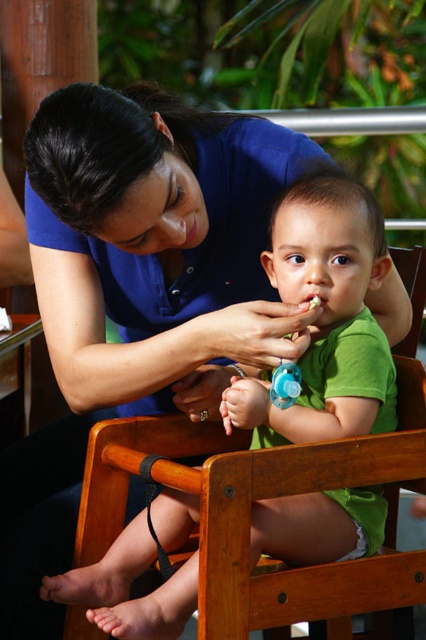
You are a parent trying to locate your child toys. You see a blue rubber sippy cup at center and a blue rubber teething ring at center. Which toy is positioned more to the left?

The blue rubber teething ring at center is positioned more to the left than the blue rubber sippy cup at center.

You are a photographer trying to capture a closeup of the blue rubber sippy cup at center without the green matte shirt at center blocking the view. Can you adjust your position to do so?

The green matte shirt at center is in front of the blue rubber sippy cup at center, so moving your camera angle slightly behind the shirt would allow you to see the sippy cup without obstruction.

You are a parent trying to decide whether to place the blue rubber sippy cup at center on the green matte shirt at center without damaging it. Based on their sizes, can the sippy cup fit on the shirt?

The green matte shirt at center is wider than the blue rubber sippy cup at center, so the sippy cup can fit on the shirt without any issues.